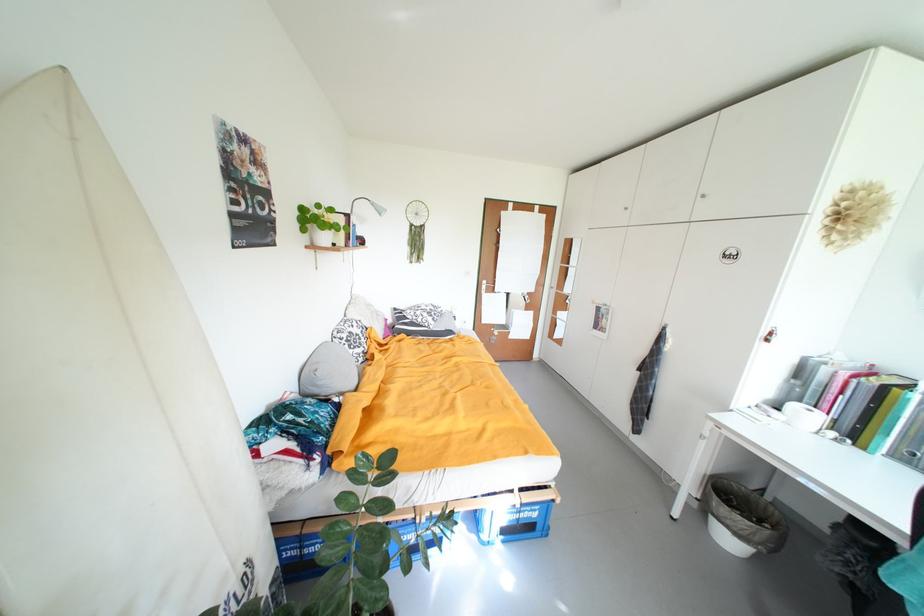
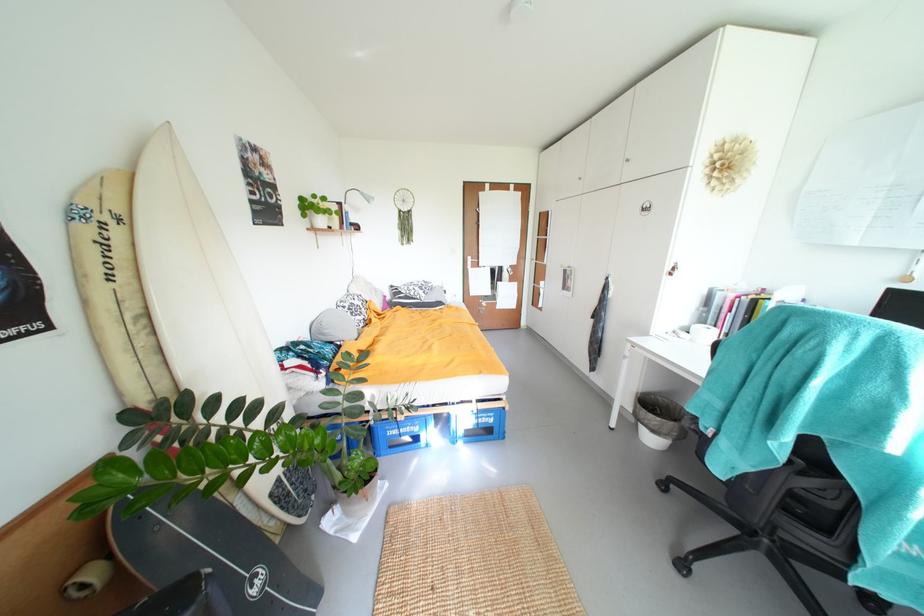
Find the pixel in the second image that matches point (772, 334) in the first image.

(675, 270)